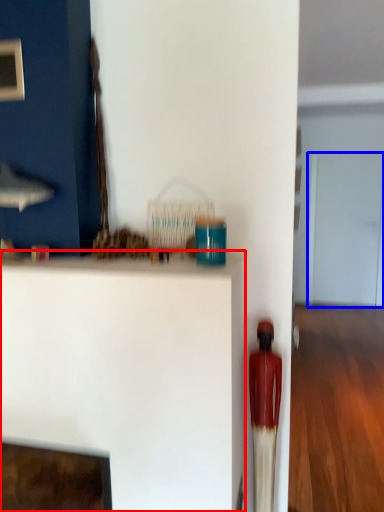
Question: Which of the following is the closest to the observer, furniture (highlighted by a red box) or glass door (highlighted by a blue box)?

Choices:
 (A) furniture
 (B) glass door

Answer: (A)